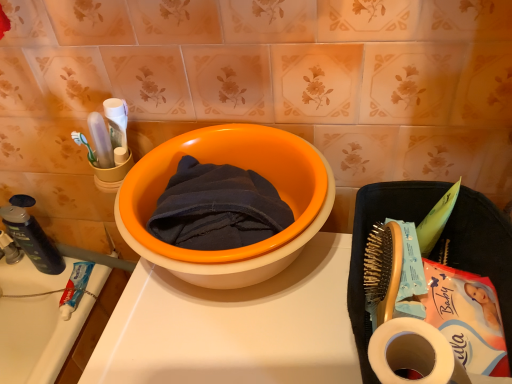
Question: Is white toothpaste tube at lower left, the 1th stationery from the right, not inside dark blue plastic soap dispenser at left, which is the 1th stationery in left-to-right order?

Choices:
 (A) no
 (B) yes

Answer: (B)

Question: From the image's perspective, is white toothpaste tube at lower left, the 1th stationery from the right, located beneath dark blue plastic soap dispenser at left, which is counted as the 2th stationery, starting from the right?

Choices:
 (A) no
 (B) yes

Answer: (B)

Question: Does white toothpaste tube at lower left, placed as the second stationery when sorted from left to right, come behind dark blue plastic soap dispenser at left, which is the 1th stationery in left-to-right order?

Choices:
 (A) no
 (B) yes

Answer: (B)

Question: Is white toothpaste tube at lower left, the 1th stationery from the right, next to dark blue plastic soap dispenser at left, which is the 1th stationery in left-to-right order?

Choices:
 (A) yes
 (B) no

Answer: (B)

Question: Does white toothpaste tube at lower left, the 1th stationery from the right, have a lesser height compared to dark blue plastic soap dispenser at left, which is counted as the 2th stationery, starting from the right?

Choices:
 (A) no
 (B) yes

Answer: (B)

Question: Is dark blue plastic soap dispenser at left, which is counted as the 2th stationery, starting from the right, completely or partially inside white toothpaste tube at lower left, the 1th stationery from the right?

Choices:
 (A) no
 (B) yes

Answer: (A)

Question: Are dark blue plastic soap dispenser at left, which is the 1th stationery in left-to-right order, and dark blue cotton towel at center far apart?

Choices:
 (A) yes
 (B) no

Answer: (B)

Question: Can you confirm if dark blue plastic soap dispenser at left, which is the 1th stationery in left-to-right order, is shorter than dark blue cotton towel at center?

Choices:
 (A) no
 (B) yes

Answer: (A)

Question: From a real-world perspective, is dark blue plastic soap dispenser at left, which is counted as the 2th stationery, starting from the right, on dark blue cotton towel at center?

Choices:
 (A) yes
 (B) no

Answer: (B)

Question: Considering the relative positions of dark blue plastic soap dispenser at left, which is counted as the 2th stationery, starting from the right, and dark blue cotton towel at center in the image provided, is dark blue plastic soap dispenser at left, which is counted as the 2th stationery, starting from the right, behind dark blue cotton towel at center?

Choices:
 (A) yes
 (B) no

Answer: (A)

Question: Can you confirm if dark blue plastic soap dispenser at left, which is the 1th stationery in left-to-right order, is smaller than dark blue cotton towel at center?

Choices:
 (A) no
 (B) yes

Answer: (B)

Question: From a real-world perspective, is dark blue plastic soap dispenser at left, which is counted as the 2th stationery, starting from the right, beneath dark blue cotton towel at center?

Choices:
 (A) yes
 (B) no

Answer: (A)

Question: Is dark blue plastic soap dispenser at left, which is the 1th stationery in left-to-right order, outside of orange plastic basin at center?

Choices:
 (A) no
 (B) yes

Answer: (B)